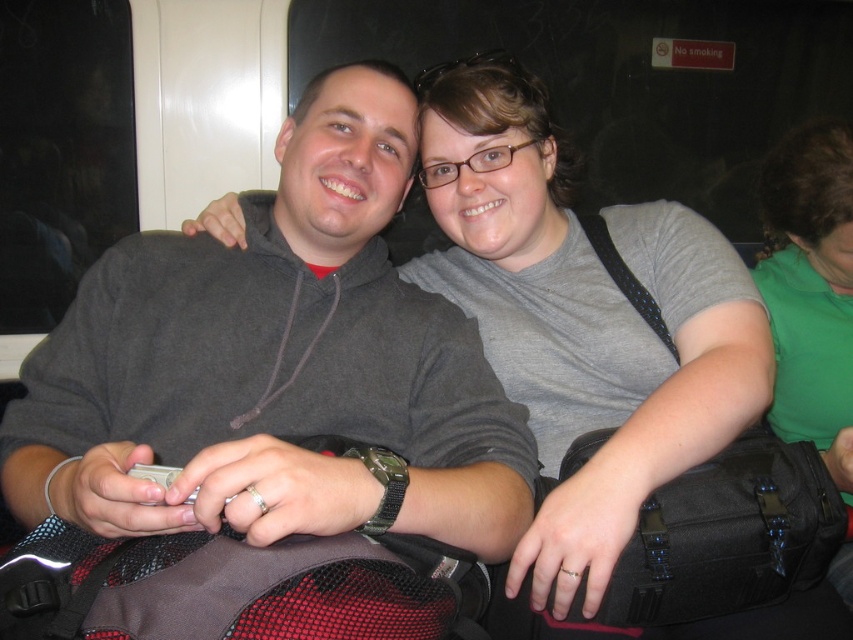
Who is lower down, dark gray hoodie at center or green fabric shirt at upper right?

Positioned lower is green fabric shirt at upper right.

Is dark gray hoodie at center above green fabric shirt at upper right?

Yes, dark gray hoodie at center is above green fabric shirt at upper right.

Identify the location of dark gray hoodie at center. (276, 365).

Identify the location of dark gray hoodie at center. (276, 365).